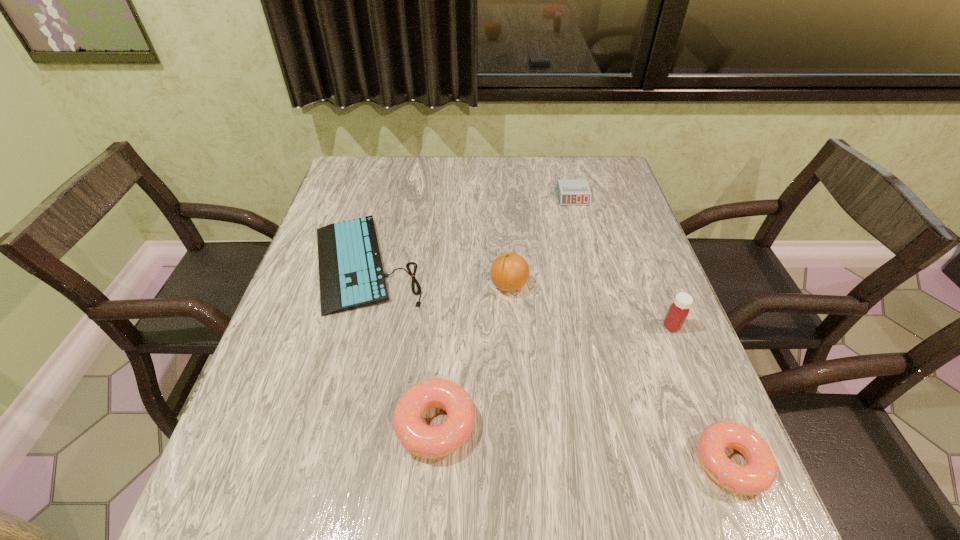
What are the coordinates of `free spot between the alarm clock and the fourth farthest object` in the screenshot? It's located at (622, 261).

The width and height of the screenshot is (960, 540). Find the location of `vacant area that lies between the right doughnut and the shortest object`. vacant area that lies between the right doughnut and the shortest object is located at coordinates (547, 363).

The width and height of the screenshot is (960, 540). Identify the location of free spot between the shortest object and the second shortest object. (468, 230).

Where is `empty space that is in between the fourth object from left to right and the shorter doughnut`? empty space that is in between the fourth object from left to right and the shorter doughnut is located at coordinates (652, 329).

The height and width of the screenshot is (540, 960). I want to click on vacant area that lies between the third nearest object and the fourth object from right to left, so click(x=590, y=306).

Where is `vacant space that is in between the taller doughnut and the farthest object`? Image resolution: width=960 pixels, height=540 pixels. vacant space that is in between the taller doughnut and the farthest object is located at coordinates (504, 310).

Locate an element on the screen. free space that is in between the third shortest object and the fourth object from right to left is located at coordinates (620, 374).

Locate an element on the screen. the fifth closest object to the fourth tallest object is located at coordinates (570, 192).

Identify which object is the second closest to the taller doughnut. Please provide its 2D coordinates. Your answer should be formatted as a tuple, i.e. [(x, y)], where the tuple contains the x and y coordinates of a point satisfying the conditions above.

[(509, 272)]

I want to click on vacant area in the image that satisfies the following two spatial constraints: 1. on the back side of the alarm clock; 2. on the right side of the fourth shortest object, so click(x=452, y=197).